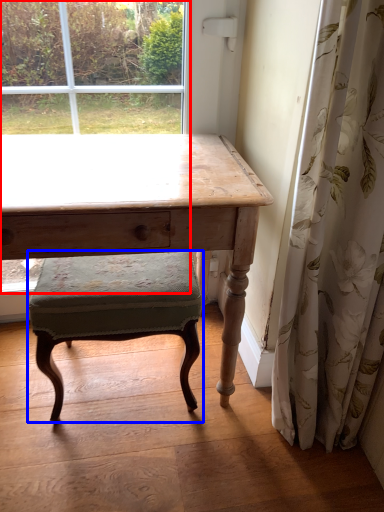
Question: Which point is further to the camera, bay window (highlighted by a red box) or stool (highlighted by a blue box)?

Choices:
 (A) bay window
 (B) stool

Answer: (B)